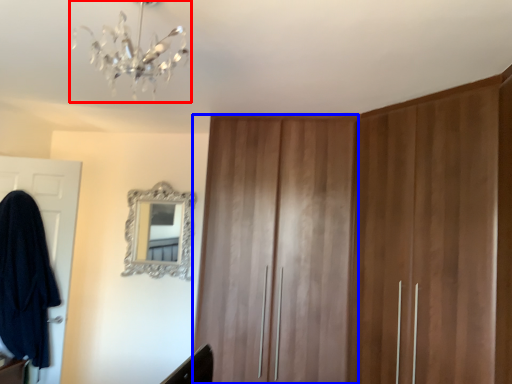
Question: Which of the following is the farthest to the observer, light fixture (highlighted by a red box) or locker (highlighted by a blue box)?

Choices:
 (A) light fixture
 (B) locker

Answer: (B)